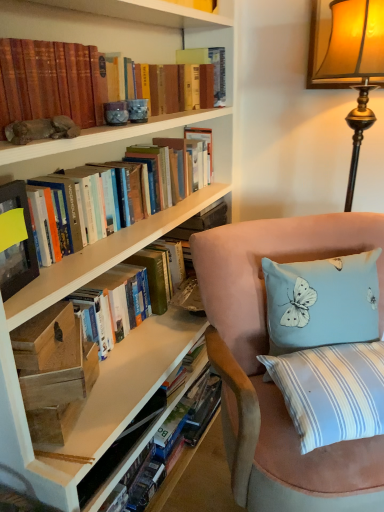
Question: Does hardcover book at center, which ranks as the 2th book in top-to-bottom order, have a smaller size compared to suede chair at lower right?

Choices:
 (A) no
 (B) yes

Answer: (B)

Question: Is hardcover book at center, acting as the 1th book starting from the bottom, in contact with suede chair at lower right?

Choices:
 (A) no
 (B) yes

Answer: (A)

Question: From a real-world perspective, is hardcover book at center, which ranks as the 2th book in top-to-bottom order, physically above suede chair at lower right?

Choices:
 (A) no
 (B) yes

Answer: (B)

Question: Can you confirm if hardcover book at center, acting as the 1th book starting from the bottom, is positioned to the right of suede chair at lower right?

Choices:
 (A) yes
 (B) no

Answer: (B)

Question: Does hardcover book at center, acting as the 1th book starting from the bottom, have a lesser width compared to suede chair at lower right?

Choices:
 (A) no
 (B) yes

Answer: (B)

Question: Choose the correct answer: Is hardcover book at upper center, the 4th paperback book from the left, inside wooden plank at lower left, which ranks as the first paperback book in bottom-to-top order, or outside it?

Choices:
 (A) outside
 (B) inside

Answer: (A)

Question: From a real-world perspective, is hardcover book at upper center, the 4th paperback book from the left, physically located above or below wooden plank at lower left, the 4th paperback book in the top-to-bottom sequence?

Choices:
 (A) below
 (B) above

Answer: (B)

Question: Considering the relative positions of hardcover book at upper center, the first paperback book in the right-to-left sequence, and wooden plank at lower left, the 4th paperback book in the top-to-bottom sequence, in the image provided, is hardcover book at upper center, the first paperback book in the right-to-left sequence, to the left or to the right of wooden plank at lower left, the 4th paperback book in the top-to-bottom sequence,?

Choices:
 (A) right
 (B) left

Answer: (A)

Question: Relative to wooden plank at lower left, the third paperback book viewed from the left, is hardcover book at upper center, which is counted as the 4th paperback book, starting from the front, in front or behind?

Choices:
 (A) front
 (B) behind

Answer: (B)

Question: From a real-world perspective, is suede chair at lower right positioned above or below hardcover book at center, which ranks as the 2th book in top-to-bottom order?

Choices:
 (A) above
 (B) below

Answer: (B)

Question: In the image, is suede chair at lower right on the left side or the right side of hardcover book at center, which ranks as the 2th book in top-to-bottom order?

Choices:
 (A) right
 (B) left

Answer: (A)

Question: In the image, is suede chair at lower right positioned in front of or behind hardcover book at center, which ranks as the 2th book in top-to-bottom order?

Choices:
 (A) front
 (B) behind

Answer: (A)

Question: Considering the positions of suede chair at lower right and hardcover book at center, acting as the 1th book starting from the bottom, in the image, is suede chair at lower right wider or thinner than hardcover book at center, acting as the 1th book starting from the bottom,?

Choices:
 (A) thin
 (B) wide

Answer: (B)

Question: Is hardcover book at upper center, positioned as the 1th paperback book in top-to-bottom order, situated inside wooden box at lower left, which is the third paperback book from right to left, or outside?

Choices:
 (A) outside
 (B) inside

Answer: (A)

Question: From the image's perspective, relative to wooden box at lower left, which is the third paperback book from right to left, is hardcover book at upper center, placed as the first paperback book when sorted from back to front, above or below?

Choices:
 (A) below
 (B) above

Answer: (B)